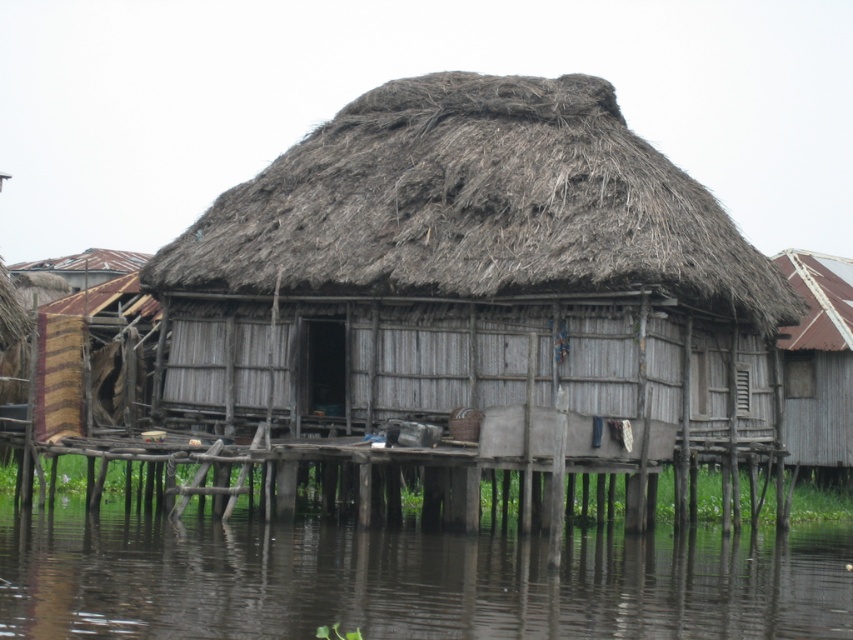
You are a visitor standing in front of the traditional thatched roof hut. You notice the dark brown water at lower center and the red tile roof at upper right. Which of these two objects occupies a wider area in the image?

The dark brown water at lower center occupies a wider area in the image than the red tile roof at upper right, as its width is larger.

You are a visitor approaching the brown thatch at center and the wooden hut at right. Which object is larger in size?

The brown thatch at center is smaller than wooden hut at right, so the wooden hut at right is larger in size.

You are standing at the origin point of the image coordinate system, which is the bottom left corner. You want to place a new wooden pole exactly at the position of the brown thatch at center. What are the coordinates where you should place the pole?

The coordinates for the brown thatch at center are at point (x=476, y=208), so you should place the wooden pole at those coordinates.